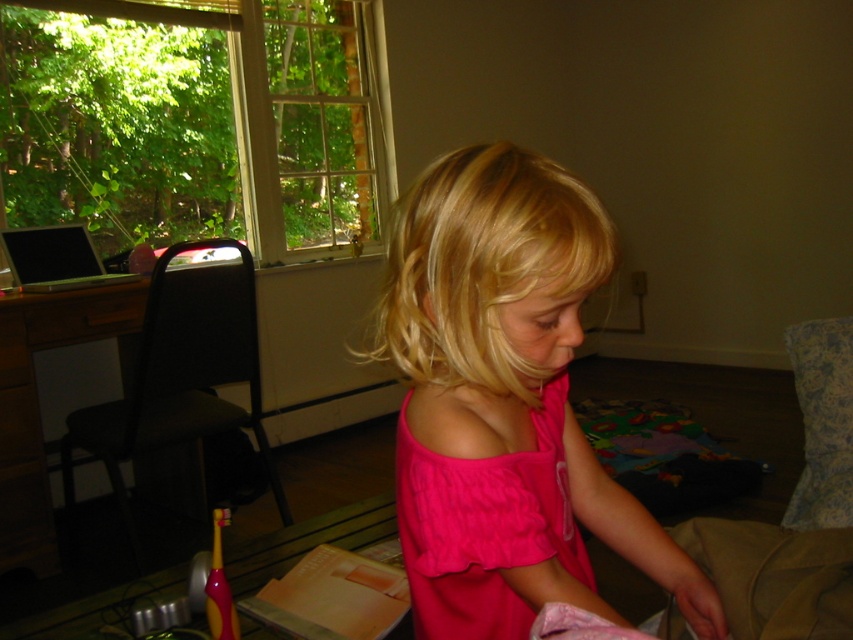
From the picture: Can you confirm if pink cotton shirt at center is thinner than cotton pink dress at center?

In fact, pink cotton shirt at center might be wider than cotton pink dress at center.

Is point (524, 280) closer to camera compared to point (397, 426)?

Yes, it is.

Is point (531, 208) less distant than point (404, 438)?

Yes.

What are the coordinates of `pink cotton shirt at center` in the screenshot? It's located at (503, 403).